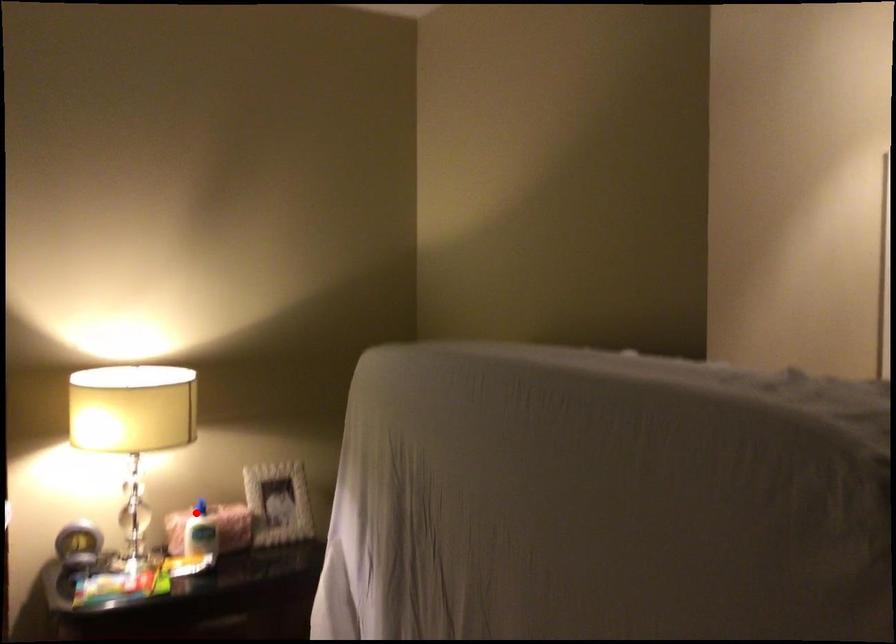
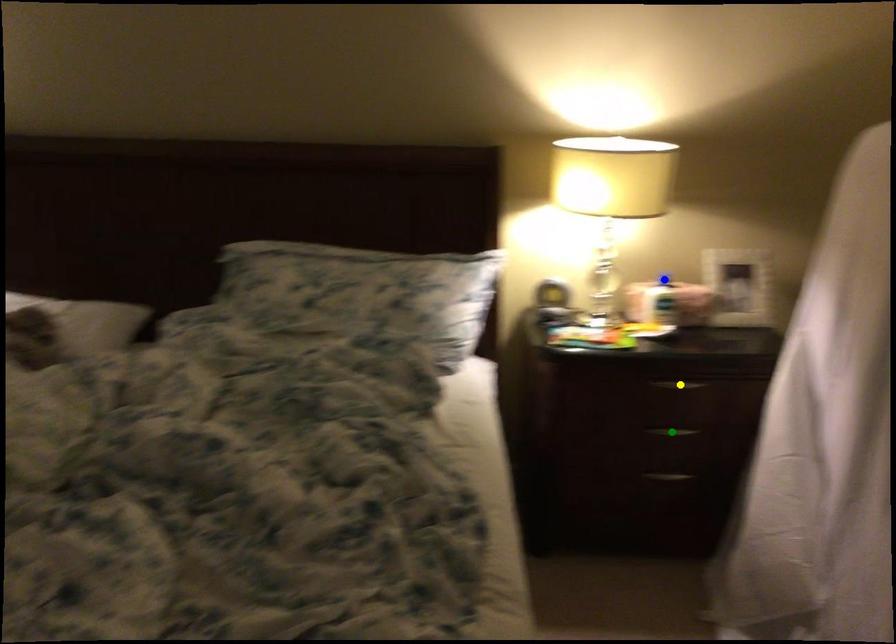
Question: I am providing you with two images of the same scene from different viewpoints. A red point is marked on the first image. You are given multiple points on the second image. Which spot in image 2 lines up with the point in image 1?

Choices:
 (A) green point
 (B) blue point
 (C) yellow point

Answer: (B)